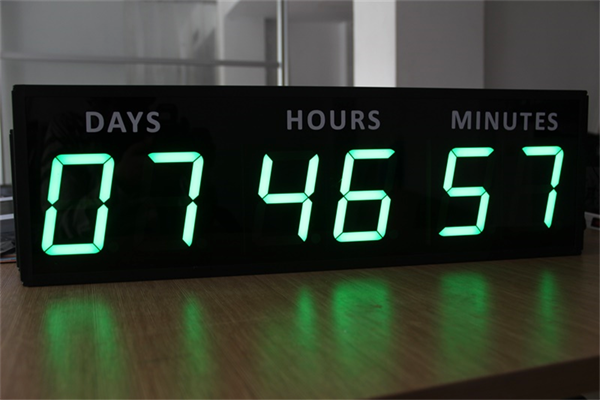
Find the location of `clock`. clock is located at coordinates (302, 168).